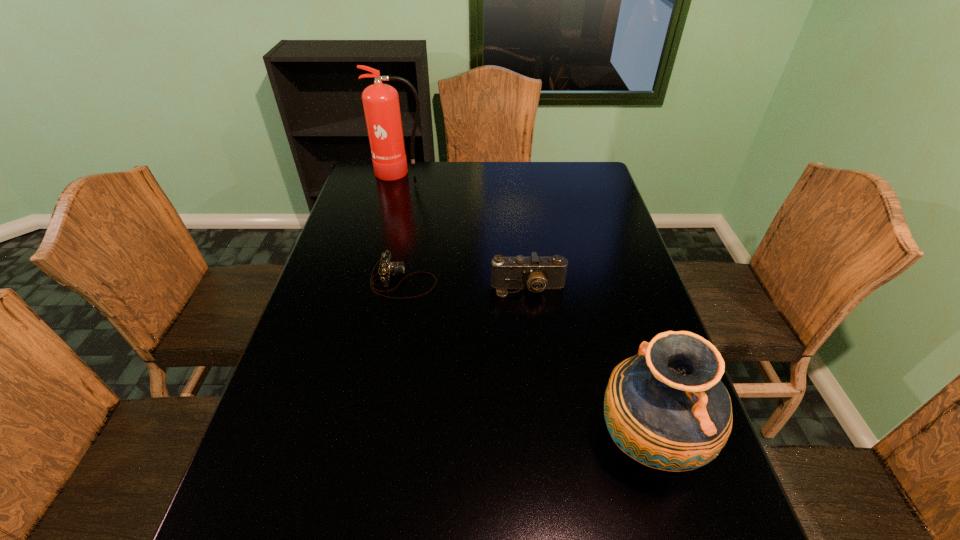
Locate an element on the screen. The height and width of the screenshot is (540, 960). object that is the nearest to the taller camera is located at coordinates (387, 268).

Select which object appears as the third closest to the shorter camera. Please provide its 2D coordinates. Your answer should be formatted as a tuple, i.e. [(x, y)], where the tuple contains the x and y coordinates of a point satisfying the conditions above.

[(381, 105)]

Locate an element on the screen. Image resolution: width=960 pixels, height=540 pixels. free space that satisfies the following two spatial constraints: 1. on the back side of the nearest object; 2. on the front-facing side of the shorter camera is located at coordinates (601, 281).

Where is `vacant space that satisfies the following two spatial constraints: 1. on the front-facing side of the shortest object; 2. on the right side of the third shortest object`? The width and height of the screenshot is (960, 540). vacant space that satisfies the following two spatial constraints: 1. on the front-facing side of the shortest object; 2. on the right side of the third shortest object is located at coordinates (374, 441).

Find the location of `blank space that satisfies the following two spatial constraints: 1. on the front-facing side of the pottery; 2. on the right side of the left camera`. blank space that satisfies the following two spatial constraints: 1. on the front-facing side of the pottery; 2. on the right side of the left camera is located at coordinates (374, 441).

What are the coordinates of `blank space that satisfies the following two spatial constraints: 1. on the front-facing side of the right camera; 2. on the right side of the third shortest object` in the screenshot? It's located at (545, 441).